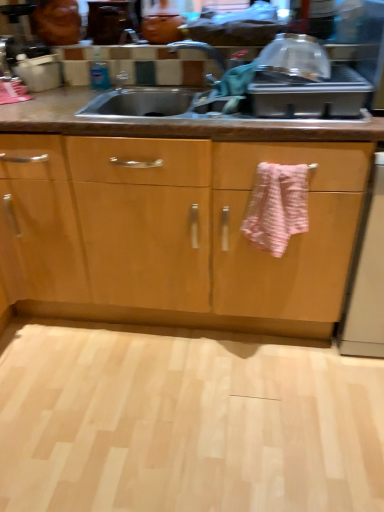
Question: Is pink textured towel at center further to camera compared to light wood floor at lower center?

Choices:
 (A) no
 (B) yes

Answer: (B)

Question: Is pink textured towel at center oriented away from light wood floor at lower center?

Choices:
 (A) yes
 (B) no

Answer: (B)

Question: Does pink textured towel at center have a greater width compared to light wood floor at lower center?

Choices:
 (A) yes
 (B) no

Answer: (B)

Question: From the image's perspective, is pink textured towel at center above light wood floor at lower center?

Choices:
 (A) no
 (B) yes

Answer: (B)

Question: Does pink textured towel at center have a lesser height compared to light wood floor at lower center?

Choices:
 (A) yes
 (B) no

Answer: (B)

Question: Based on their positions, is white glossy dishwasher at right located to the left or right of light wood floor at lower center?

Choices:
 (A) right
 (B) left

Answer: (A)

Question: From the image's perspective, is white glossy dishwasher at right located above or below light wood floor at lower center?

Choices:
 (A) above
 (B) below

Answer: (A)

Question: From a real-world perspective, is white glossy dishwasher at right positioned above or below light wood floor at lower center?

Choices:
 (A) above
 (B) below

Answer: (A)

Question: In terms of width, does white glossy dishwasher at right look wider or thinner when compared to light wood floor at lower center?

Choices:
 (A) wide
 (B) thin

Answer: (B)

Question: From the image's perspective, is pink textured towel at center positioned above or below light wood floor at lower center?

Choices:
 (A) below
 (B) above

Answer: (B)

Question: Is point (261, 175) closer or farther from the camera than point (221, 334)?

Choices:
 (A) farther
 (B) closer

Answer: (B)

Question: From a real-world perspective, is pink textured towel at center above or below light wood floor at lower center?

Choices:
 (A) below
 (B) above

Answer: (B)

Question: From their relative heights in the image, would you say pink textured towel at center is taller or shorter than light wood floor at lower center?

Choices:
 (A) short
 (B) tall

Answer: (B)

Question: Visually, is pink textured towel at center positioned to the left or to the right of white glossy dishwasher at right?

Choices:
 (A) right
 (B) left

Answer: (B)

Question: From a real-world perspective, is pink textured towel at center positioned above or below white glossy dishwasher at right?

Choices:
 (A) below
 (B) above

Answer: (B)